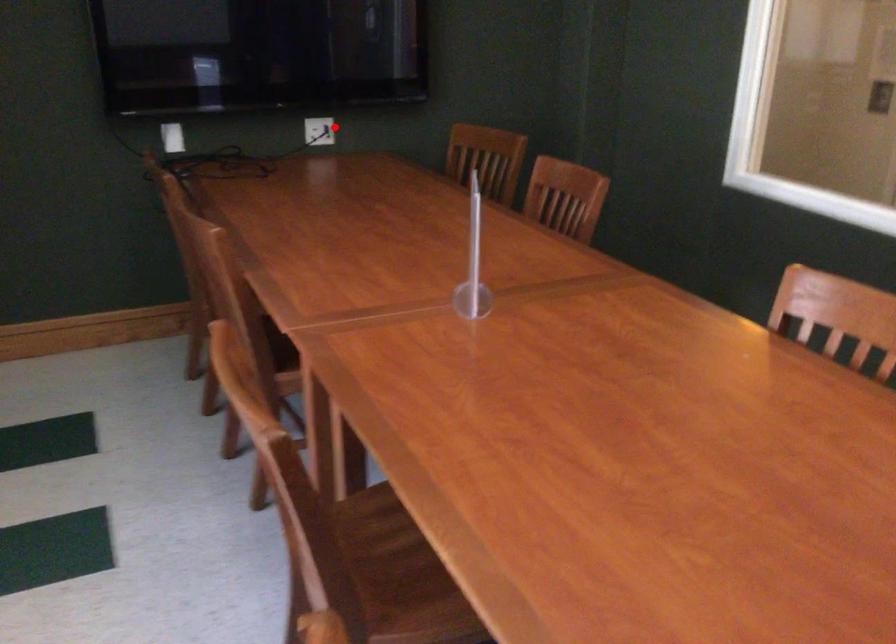
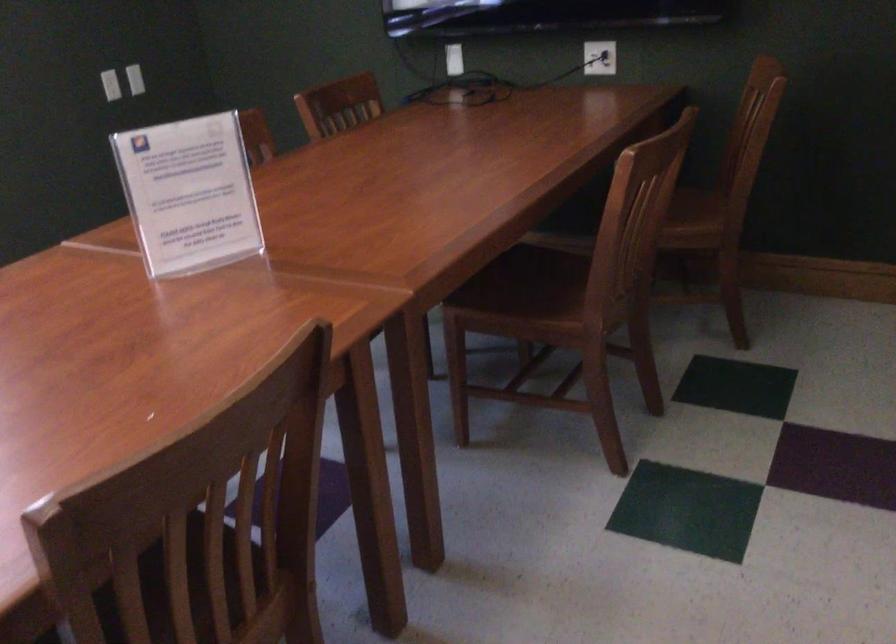
Question: I am providing you with two images of the same scene from different viewpoints. A red point is shown in image1. For the corresponding object point in image2, is it positioned nearer or farther from the camera?

Choices:
 (A) Nearer
 (B) Farther

Answer: (A)